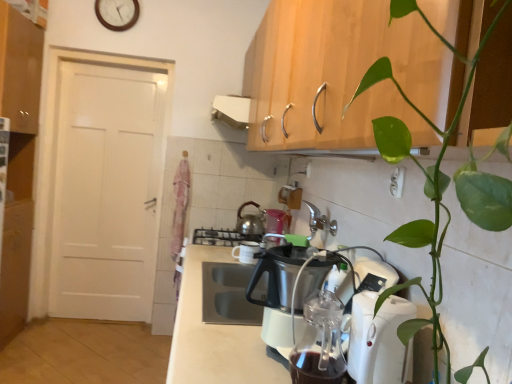
Question: From a real-world perspective, does white wooden clock at upper center stand above matte wood cabinet at upper left?

Choices:
 (A) yes
 (B) no

Answer: (A)

Question: Does white wooden clock at upper center have a lesser width compared to matte wood cabinet at upper left?

Choices:
 (A) yes
 (B) no

Answer: (A)

Question: Is white wooden clock at upper center directly adjacent to matte wood cabinet at upper left?

Choices:
 (A) yes
 (B) no

Answer: (B)

Question: Can matte wood cabinet at upper left be found inside white wooden clock at upper center?

Choices:
 (A) yes
 (B) no

Answer: (B)

Question: From a real-world perspective, is white wooden clock at upper center below matte wood cabinet at upper left?

Choices:
 (A) no
 (B) yes

Answer: (A)

Question: Looking at their shapes, would you say shiny metallic kettle at center, arranged as the second kitchen appliance when viewed from the front, is wider or thinner than white wooden clock at upper center?

Choices:
 (A) wide
 (B) thin

Answer: (A)

Question: From a real-world perspective, is shiny metallic kettle at center, arranged as the second kitchen appliance when viewed from the front, physically located above or below white wooden clock at upper center?

Choices:
 (A) above
 (B) below

Answer: (B)

Question: Choose the correct answer: Is shiny metallic kettle at center, acting as the first kitchen appliance starting from the back, inside white wooden clock at upper center or outside it?

Choices:
 (A) outside
 (B) inside

Answer: (A)

Question: Is shiny metallic kettle at center, acting as the first kitchen appliance starting from the back, bigger or smaller than white wooden clock at upper center?

Choices:
 (A) big
 (B) small

Answer: (A)

Question: Is white plastic kettle at lower right, positioned as the first kitchen appliance in right-to-left order, bigger or smaller than white plastic countertop at center?

Choices:
 (A) small
 (B) big

Answer: (A)

Question: Looking at their shapes, would you say white plastic kettle at lower right, positioned as the first kitchen appliance in right-to-left order, is wider or thinner than white plastic countertop at center?

Choices:
 (A) thin
 (B) wide

Answer: (A)

Question: Considering the positions of point (358, 347) and point (190, 370), is point (358, 347) closer or farther from the camera than point (190, 370)?

Choices:
 (A) farther
 (B) closer

Answer: (B)

Question: From a real-world perspective, is white plastic kettle at lower right, marked as the 1th kitchen appliance in a front-to-back arrangement, above or below white plastic countertop at center?

Choices:
 (A) above
 (B) below

Answer: (B)

Question: From the image's perspective, is shiny metallic kettle at center, arranged as the second kitchen appliance when viewed from the front, above or below white plastic electric outlet at upper center?

Choices:
 (A) below
 (B) above

Answer: (A)

Question: Is shiny metallic kettle at center, the second kitchen appliance when ordered from right to left, taller or shorter than white plastic electric outlet at upper center?

Choices:
 (A) tall
 (B) short

Answer: (A)